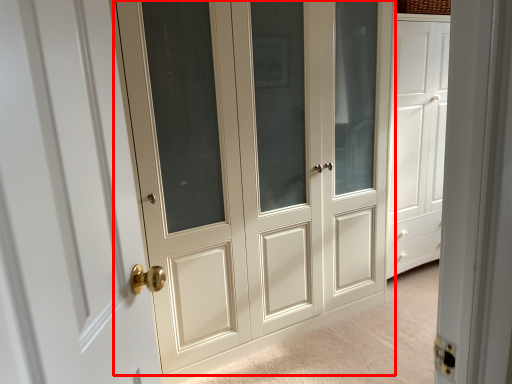
Question: Observing the image, what is the correct spatial positioning of door (annotated by the red box) in reference to door?

Choices:
 (A) left
 (B) right

Answer: (B)